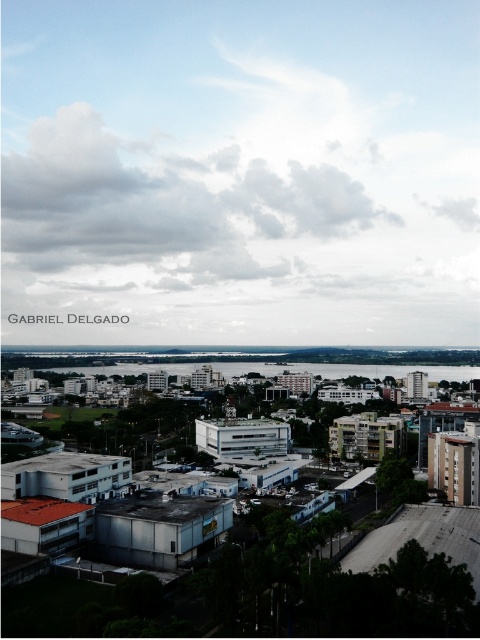
Between cloudy sky at upper center and clear water at center, which one appears on the left side from the viewer's perspective?

Positioned to the left is cloudy sky at upper center.

Can you confirm if cloudy sky at upper center is shorter than clear water at center?

Incorrect, cloudy sky at upper center's height does not fall short of clear water at center's.

Identify the location of cloudy sky at upper center. The image size is (480, 640). (240, 166).

Identify the location of cloudy sky at upper center. (240, 166).